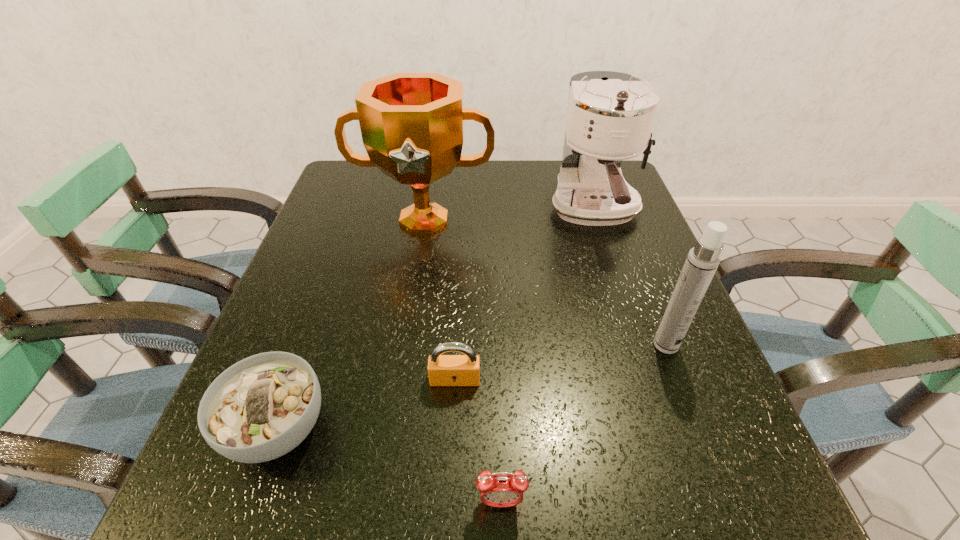
Find the location of a particular element. Image resolution: width=960 pixels, height=540 pixels. vacant area between the soup bowl and the padlock is located at coordinates (366, 404).

What are the coordinates of `vacant space that's between the soup bowl and the third tallest object` in the screenshot? It's located at (471, 386).

Find the location of a particular element. This screenshot has height=540, width=960. vacant area that lies between the padlock and the aerosol can is located at coordinates (561, 362).

Locate an element on the screen. empty space between the aerosol can and the nearest object is located at coordinates (584, 423).

The width and height of the screenshot is (960, 540). Find the location of `free space between the alarm clock and the padlock`. free space between the alarm clock and the padlock is located at coordinates (478, 441).

Identify the location of free space between the coffee maker and the nearest object. (548, 356).

At what (x,y) coordinates should I click in order to perform the action: click on free point between the soup bowl and the alarm clock. Please return your answer as a coordinate pair (x, y). Looking at the image, I should click on (389, 465).

Identify which object is the third closest to the soup bowl. Please provide its 2D coordinates. Your answer should be formatted as a tuple, i.e. [(x, y)], where the tuple contains the x and y coordinates of a point satisfying the conditions above.

[(412, 124)]

This screenshot has width=960, height=540. I want to click on object that stands as the third closest to the padlock, so tap(702, 261).

What are the coordinates of `blank area in the image that satisfies the following two spatial constraints: 1. on the front-facing side of the fourth shortest object; 2. on the right side of the coffee maker` in the screenshot? It's located at (639, 345).